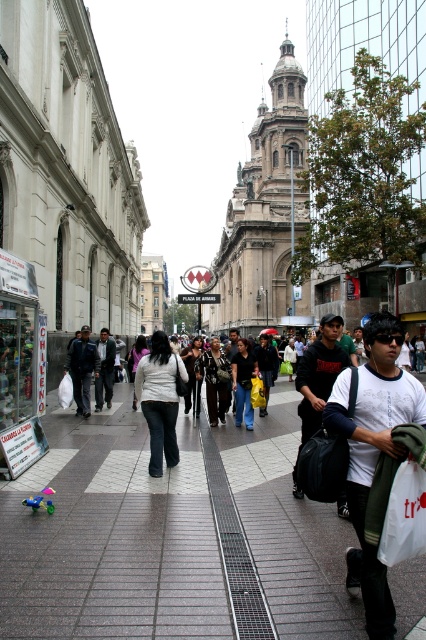
You are a delivery person standing on the gray concrete sidewalk at center and need to deliver a package to someone wearing dark gray pants at left. Which direction should you move to reach them?

The gray concrete sidewalk at center is positioned on the right side of dark gray pants at left, so you should move to your left to reach them.

Looking at this image, you are standing on the pedestrian walkway in the city scene and see both the dark gray jeans at center and the dark gray jacket at center. Which item is closer to you?

The dark gray jeans at center is closer to the viewer than the dark gray jacket at center.

In the scene shown: You are a pedestrian standing on the gray concrete sidewalk at center. Looking up, do you see the dark gray pants at left above or below you?

The gray concrete sidewalk at center is positioned under dark gray pants at left, so looking up, you would see the dark gray pants at left above you.